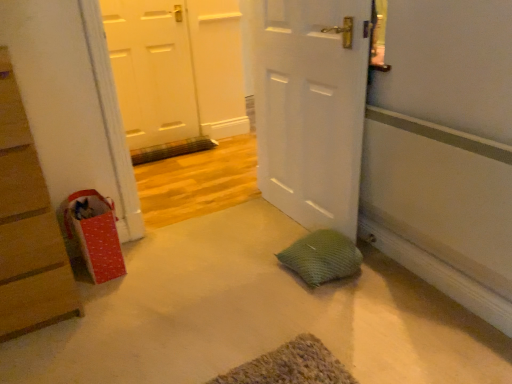
You are a GUI agent. You are given a task and a screenshot of the screen. Output one action in this format:
    pyautogui.click(x=<x>, y=<y>)
    Task: Click on the vacant point to the right of red cardboard chest of drawers at left
    
    Given the screenshot: What is the action you would take?
    pyautogui.click(x=130, y=298)